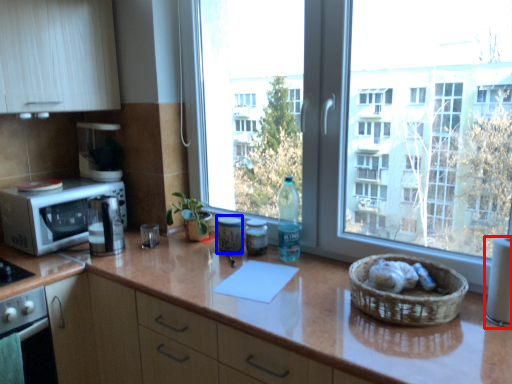
Question: Which object appears farthest to the camera in this image, appliance (highlighted by a red box) or appliance (highlighted by a blue box)?

Choices:
 (A) appliance
 (B) appliance

Answer: (B)